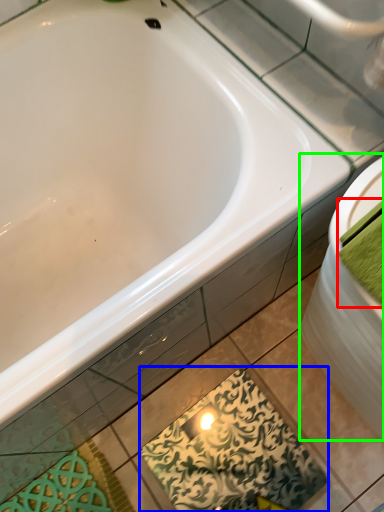
Question: Estimate the real-world distances between objects in this image. Which object is closer to bath towel (highlighted by a red box), design (highlighted by a blue box) or sink (highlighted by a green box)?

Choices:
 (A) design
 (B) sink

Answer: (B)